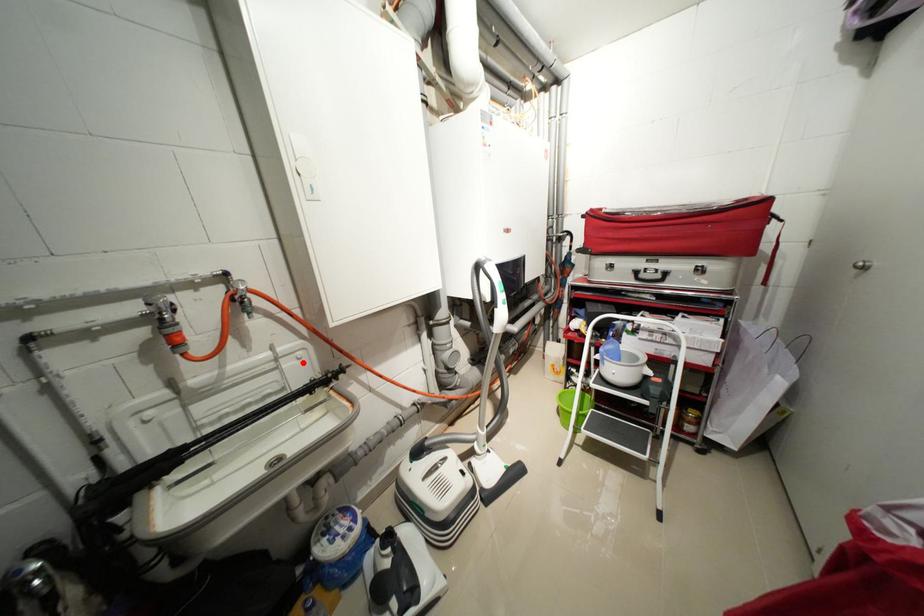
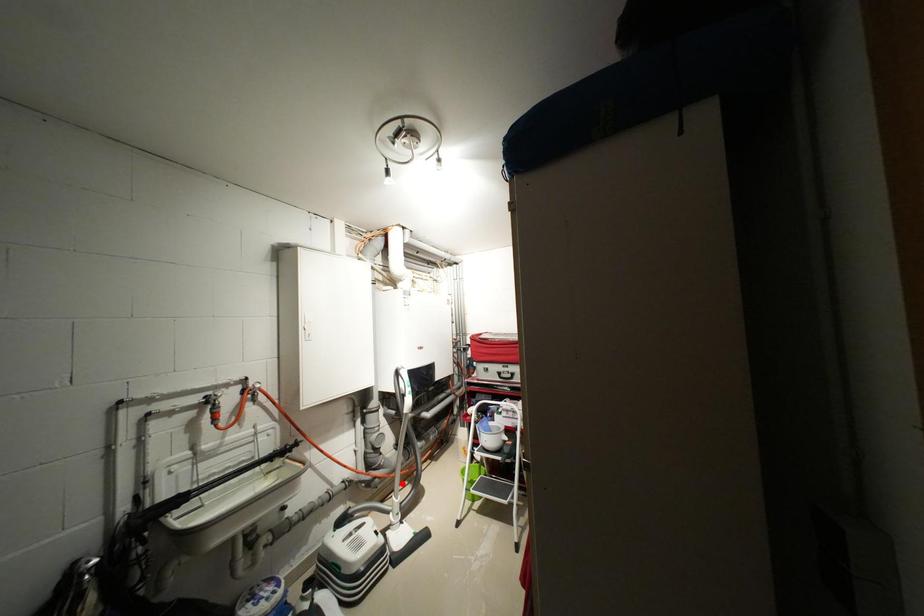
I am providing you with two images of the same scene from different viewpoints. A red point is marked on the first image and another point is marked on the second image. Is the red point in image1 aligned with the point shown in image2?

No